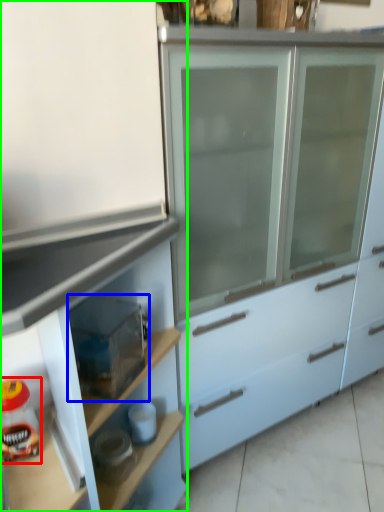
Question: Based on their relative distances, which object is farther from food (highlighted by a red box)? Choose from appliance (highlighted by a blue box) and cabinetry (highlighted by a green box).

Choices:
 (A) appliance
 (B) cabinetry

Answer: (B)